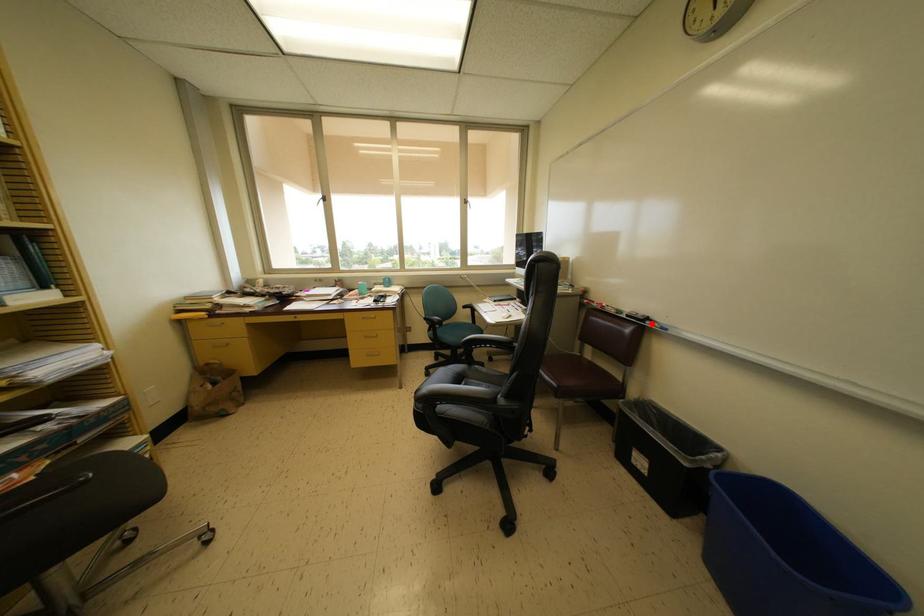
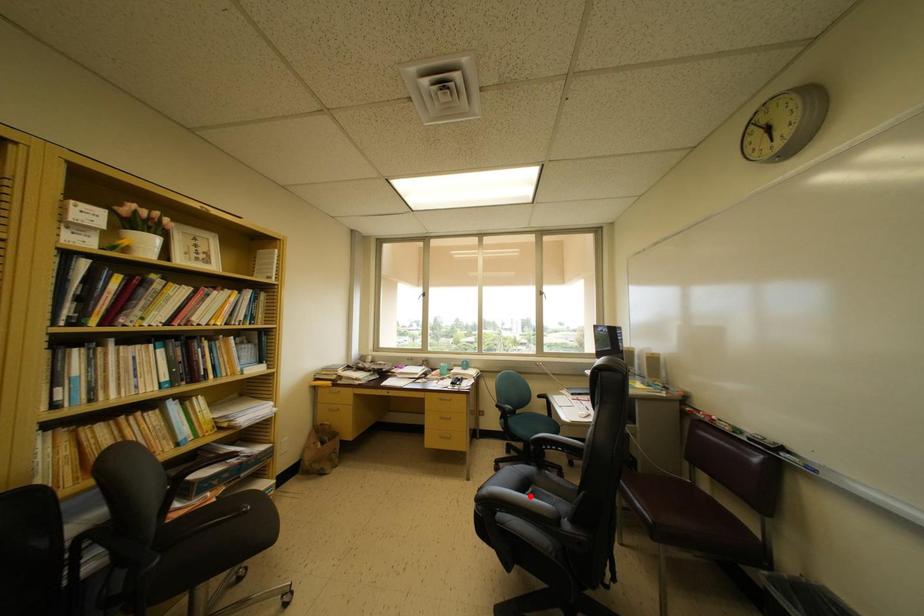
I am providing you with two images of the same scene from different viewpoints. A red point is marked on the first image and another point is marked on the second image. Is the red point in image1 aligned with the point shown in image2?

No